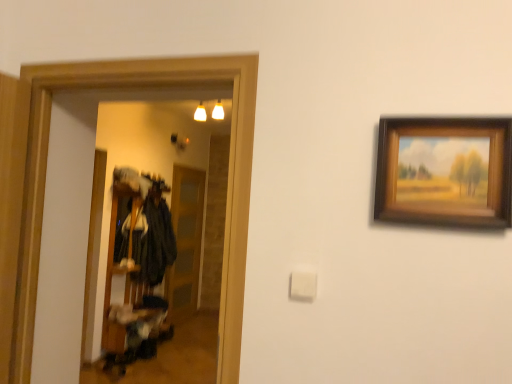
Question: Does transparent glass door at center have a smaller size compared to velvet black coat at center?

Choices:
 (A) no
 (B) yes

Answer: (A)

Question: From a real-world perspective, is transparent glass door at center located higher than velvet black coat at center?

Choices:
 (A) no
 (B) yes

Answer: (A)

Question: Is transparent glass door at center positioned with its back to velvet black coat at center?

Choices:
 (A) no
 (B) yes

Answer: (A)

Question: Can velvet black coat at center be found inside transparent glass door at center?

Choices:
 (A) yes
 (B) no

Answer: (B)

Question: Can you confirm if transparent glass door at center is bigger than velvet black coat at center?

Choices:
 (A) no
 (B) yes

Answer: (B)

Question: Is the position of transparent glass door at center less distant than that of velvet black coat at center?

Choices:
 (A) no
 (B) yes

Answer: (A)

Question: Does velvet black coat at center lie in front of transparent glass door at center?

Choices:
 (A) no
 (B) yes

Answer: (B)

Question: Is velvet black coat at center beside transparent glass door at center?

Choices:
 (A) yes
 (B) no

Answer: (B)

Question: Considering the relative positions of velvet black coat at center and transparent glass door at center in the image provided, is velvet black coat at center behind transparent glass door at center?

Choices:
 (A) yes
 (B) no

Answer: (B)

Question: From a real-world perspective, is velvet black coat at center under transparent glass door at center?

Choices:
 (A) no
 (B) yes

Answer: (A)

Question: From the image's perspective, is velvet black coat at center above transparent glass door at center?

Choices:
 (A) no
 (B) yes

Answer: (B)

Question: Could you tell me if velvet black coat at center is turned towards transparent glass door at center?

Choices:
 (A) no
 (B) yes

Answer: (A)

Question: From a real-world perspective, is velvet black coat at center positioned under wooden picture frame at upper right based on gravity?

Choices:
 (A) no
 (B) yes

Answer: (B)